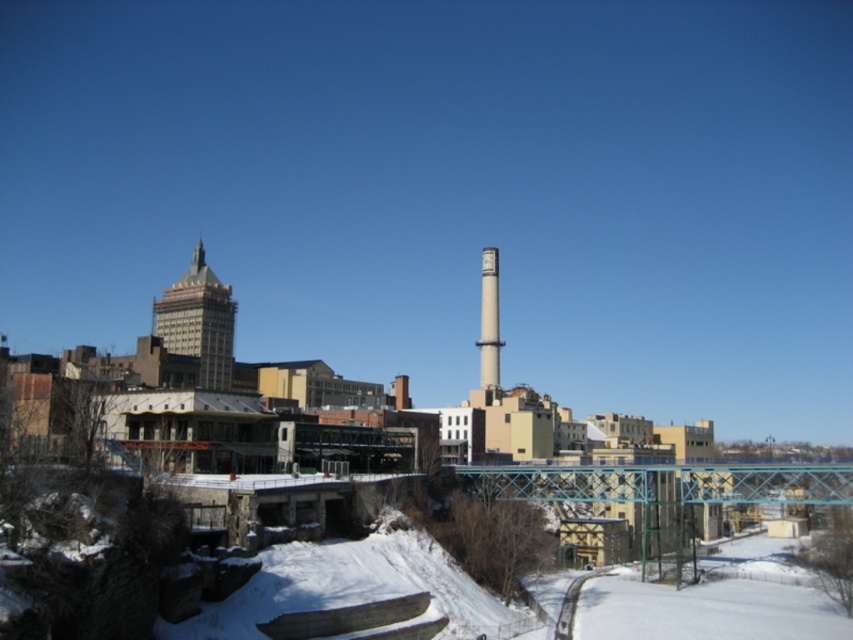
Can you confirm if gold textured building at upper left is positioned to the left of smooth concrete tower at center?

A: Indeed, gold textured building at upper left is positioned on the left side of smooth concrete tower at center.

Can you confirm if gold textured building at upper left is thinner than smooth concrete tower at center?

Incorrect, gold textured building at upper left's width is not less than smooth concrete tower at center's.

Where is `gold textured building at upper left`? The image size is (853, 640). gold textured building at upper left is located at coordinates (198, 321).

This screenshot has height=640, width=853. Find the location of `gold textured building at upper left`. gold textured building at upper left is located at coordinates (198, 321).